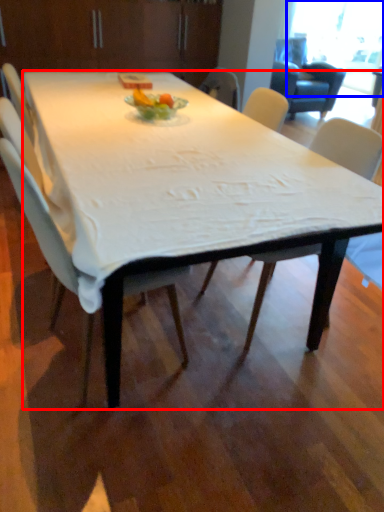
Question: Which of the following is the farthest to the observer, desk (highlighted by a red box) or window screen (highlighted by a blue box)?

Choices:
 (A) desk
 (B) window screen

Answer: (B)